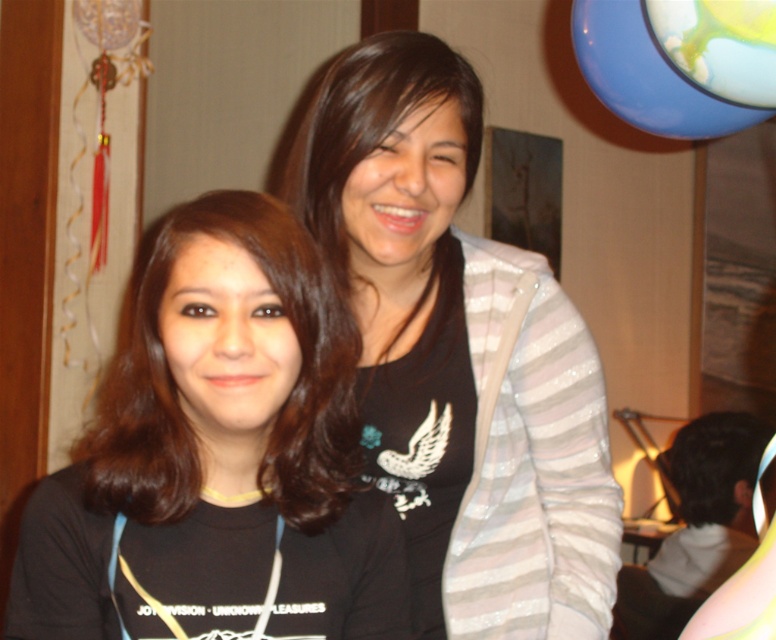
Question: Does matte black shirt at center lie behind black matte shirt at center?

Choices:
 (A) no
 (B) yes

Answer: (B)

Question: Which object is closer to the camera taking this photo?

Choices:
 (A) black matte shirt at center
 (B) matte black shirt at center

Answer: (A)

Question: Observing the image, what is the correct spatial positioning of matte black shirt at center in reference to black matte shirt at center?

Choices:
 (A) below
 (B) above

Answer: (B)

Question: Which of the following is the farthest from the observer?

Choices:
 (A) matte black shirt at center
 (B) black matte shirt at center

Answer: (A)

Question: Does matte black shirt at center lie in front of black matte shirt at center?

Choices:
 (A) yes
 (B) no

Answer: (B)

Question: Among these objects, which one is nearest to the camera?

Choices:
 (A) matte black shirt at center
 (B) black matte shirt at center

Answer: (B)